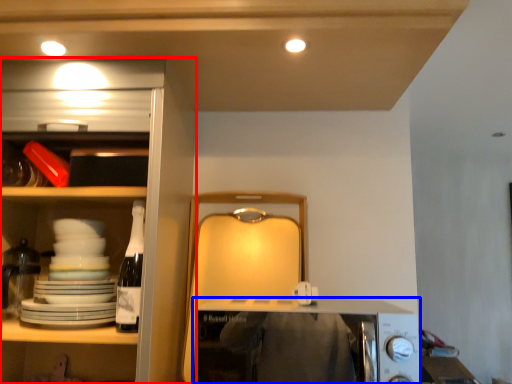
Question: Which point is further to the camera, cabinetry (highlighted by a red box) or appliance (highlighted by a blue box)?

Choices:
 (A) cabinetry
 (B) appliance

Answer: (A)